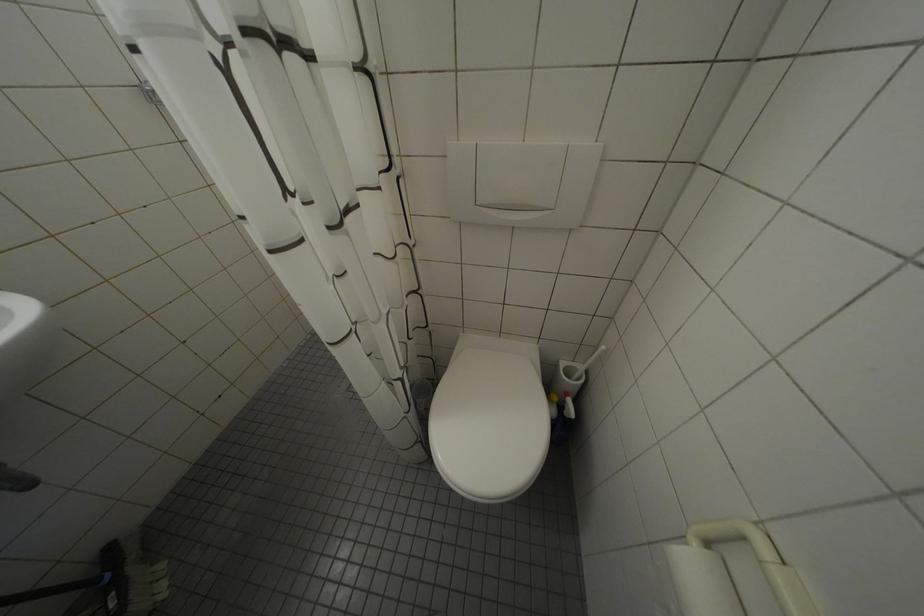
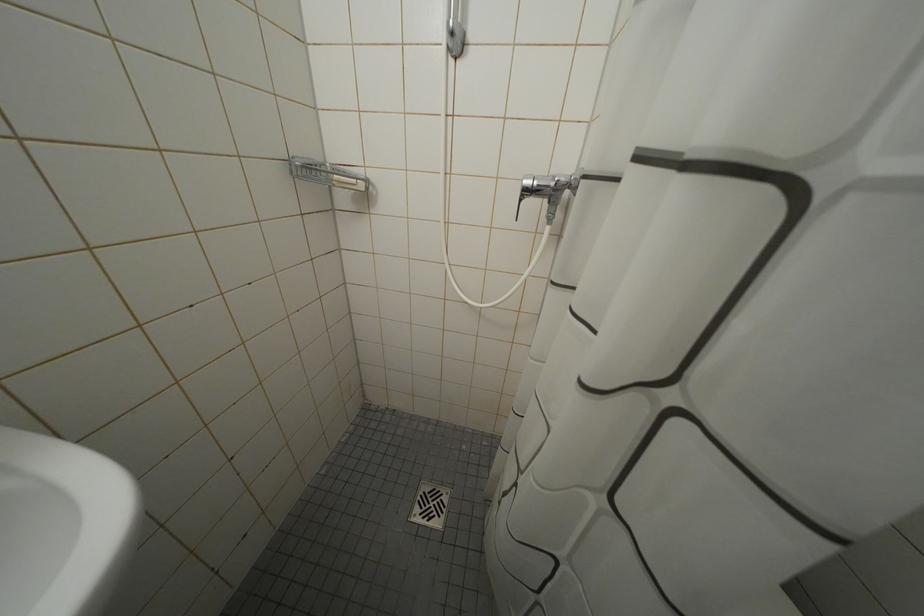
Question: What movement of the cameraman would produce the second image?

Choices:
 (A) Left
 (B) Right
 (C) Forward
 (D) Backward

Answer: (A)